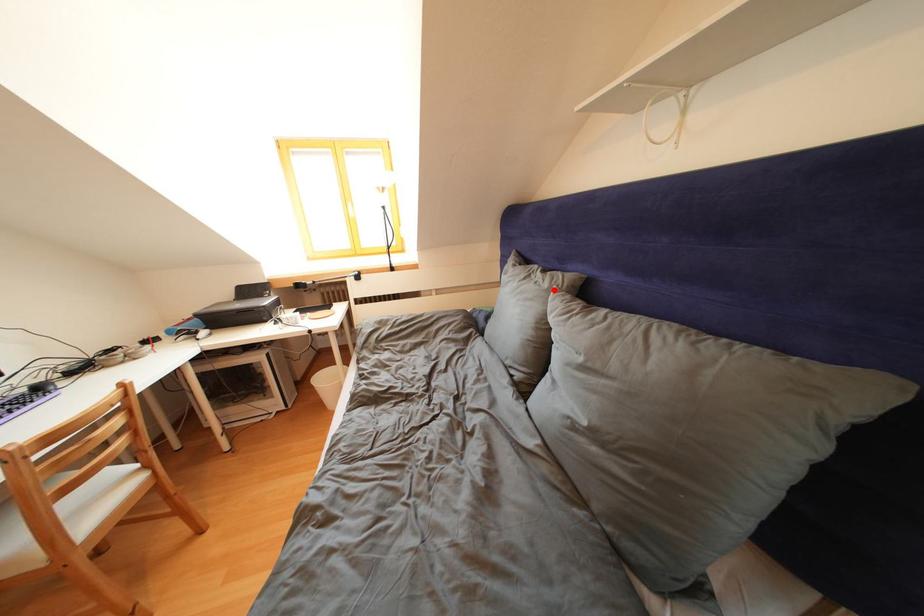
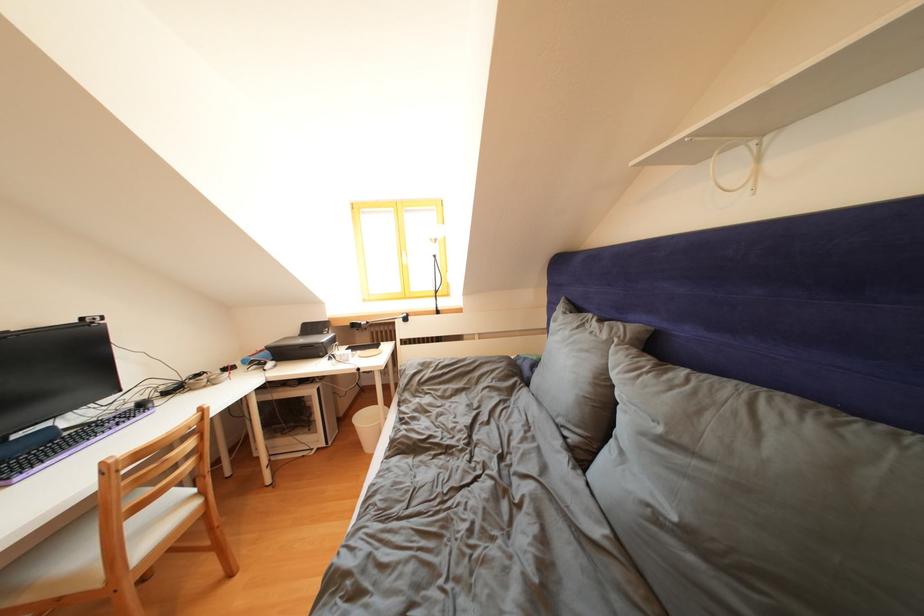
Find the pixel in the second image that matches the highlighted location in the first image.

(612, 341)